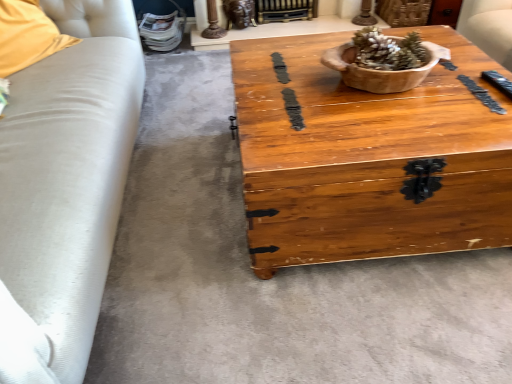
Question: Considering the relative sizes of wooden bowl at center and soft yellow fabric pillow at left in the image provided, is wooden bowl at center bigger than soft yellow fabric pillow at left?

Choices:
 (A) no
 (B) yes

Answer: (A)

Question: Is wooden bowl at center at the right side of soft yellow fabric pillow at left?

Choices:
 (A) yes
 (B) no

Answer: (A)

Question: Is wooden bowl at center outside of soft yellow fabric pillow at left?

Choices:
 (A) no
 (B) yes

Answer: (B)

Question: Considering the relative sizes of wooden bowl at center and soft yellow fabric pillow at left in the image provided, is wooden bowl at center thinner than soft yellow fabric pillow at left?

Choices:
 (A) no
 (B) yes

Answer: (A)

Question: From the image's perspective, is wooden bowl at center on soft yellow fabric pillow at left?

Choices:
 (A) no
 (B) yes

Answer: (A)

Question: Considering the relative sizes of wooden bowl at center and soft yellow fabric pillow at left in the image provided, is wooden bowl at center wider than soft yellow fabric pillow at left?

Choices:
 (A) yes
 (B) no

Answer: (A)

Question: Considering the relative sizes of soft yellow fabric pillow at left and wooden bowl at center in the image provided, is soft yellow fabric pillow at left wider than wooden bowl at center?

Choices:
 (A) no
 (B) yes

Answer: (A)

Question: From the image's perspective, does soft yellow fabric pillow at left appear lower than wooden bowl at center?

Choices:
 (A) no
 (B) yes

Answer: (A)

Question: From the image's perspective, would you say soft yellow fabric pillow at left is positioned over wooden bowl at center?

Choices:
 (A) yes
 (B) no

Answer: (A)

Question: Is soft yellow fabric pillow at left outside wooden bowl at center?

Choices:
 (A) no
 (B) yes

Answer: (B)

Question: Is soft yellow fabric pillow at left far away from wooden bowl at center?

Choices:
 (A) yes
 (B) no

Answer: (A)

Question: Considering the relative sizes of soft yellow fabric pillow at left and wooden bowl at center in the image provided, is soft yellow fabric pillow at left shorter than wooden bowl at center?

Choices:
 (A) no
 (B) yes

Answer: (A)

Question: Can you confirm if gold metallic fireplace at upper center is taller than wooden chest at center?

Choices:
 (A) yes
 (B) no

Answer: (B)